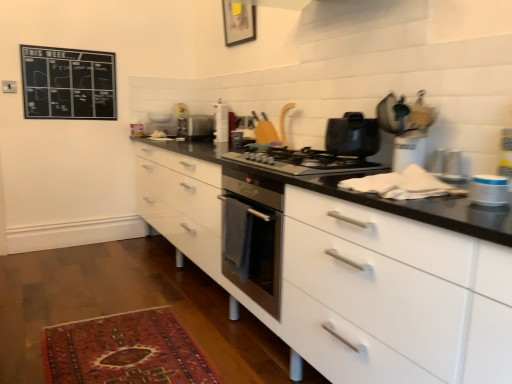
Find the location of a particular element. This screenshot has height=384, width=512. free space below black chalkboard at upper left (from a real-world perspective) is located at coordinates (78, 214).